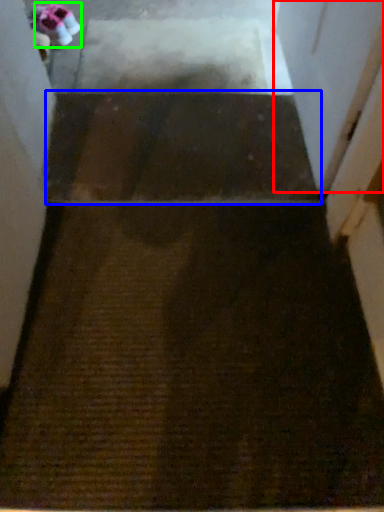
Question: Estimate the real-world distances between objects in this image. Which object is closer to screen door (highlighted by a red box), stairwell (highlighted by a blue box) or shoe (highlighted by a green box)?

Choices:
 (A) stairwell
 (B) shoe

Answer: (A)